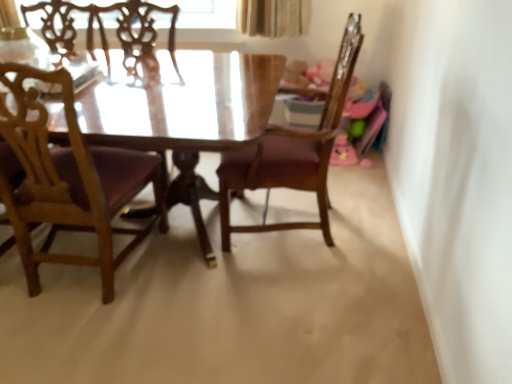
Question: From a real-world perspective, is wooden chair at left, the 1th chair from the left, physically located above or below wooden chair at center, the second chair when ordered from left to right?

Choices:
 (A) above
 (B) below

Answer: (B)

Question: Is wooden chair at left, the 2th chair positioned from the right, inside or outside of wooden chair at center, the second chair when ordered from left to right?

Choices:
 (A) inside
 (B) outside

Answer: (B)

Question: Considering their positions, is wooden chair at left, the 2th chair positioned from the right, located in front of or behind wooden chair at center, the second chair when ordered from left to right?

Choices:
 (A) front
 (B) behind

Answer: (A)

Question: From the image's perspective, is wooden chair at center, which is the 1th chair in right-to-left order, positioned above or below wooden chair at left, the 2th chair positioned from the right?

Choices:
 (A) below
 (B) above

Answer: (B)

Question: Considering the positions of wooden chair at center, the second chair when ordered from left to right, and wooden chair at left, the 2th chair positioned from the right, in the image, is wooden chair at center, the second chair when ordered from left to right, bigger or smaller than wooden chair at left, the 2th chair positioned from the right,?

Choices:
 (A) small
 (B) big

Answer: (B)

Question: Choose the correct answer: Is wooden chair at center, which is the 1th chair in right-to-left order, inside wooden chair at left, the 2th chair positioned from the right, or outside it?

Choices:
 (A) outside
 (B) inside

Answer: (A)

Question: From a real-world perspective, relative to wooden chair at left, the 1th chair from the left, is wooden chair at center, the second chair when ordered from left to right, vertically above or below?

Choices:
 (A) below
 (B) above

Answer: (B)